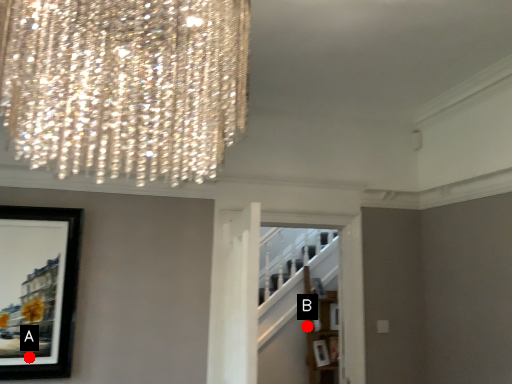
Question: Two points are circled on the image, labeled by A and B beside each circle. Which of the following is the farthest from the observer?

Choices:
 (A) A is further
 (B) B is further

Answer: (B)